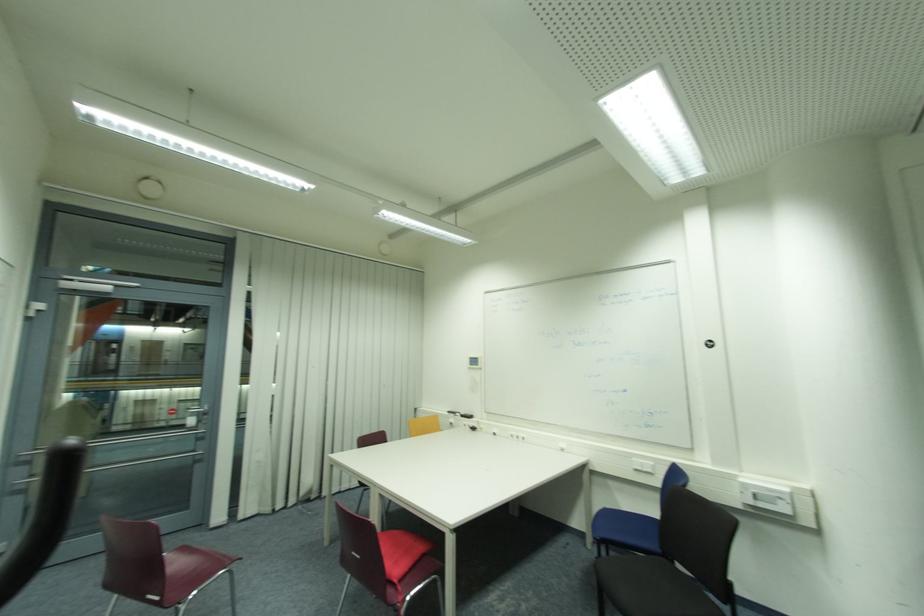
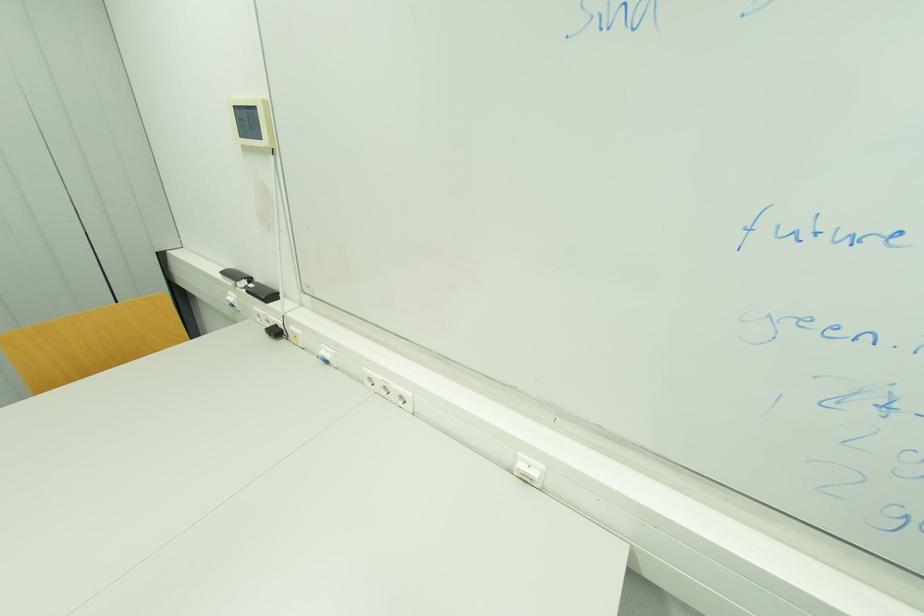
Find the pixel in the second image that matches (x=475, y=359) in the first image.

(237, 108)